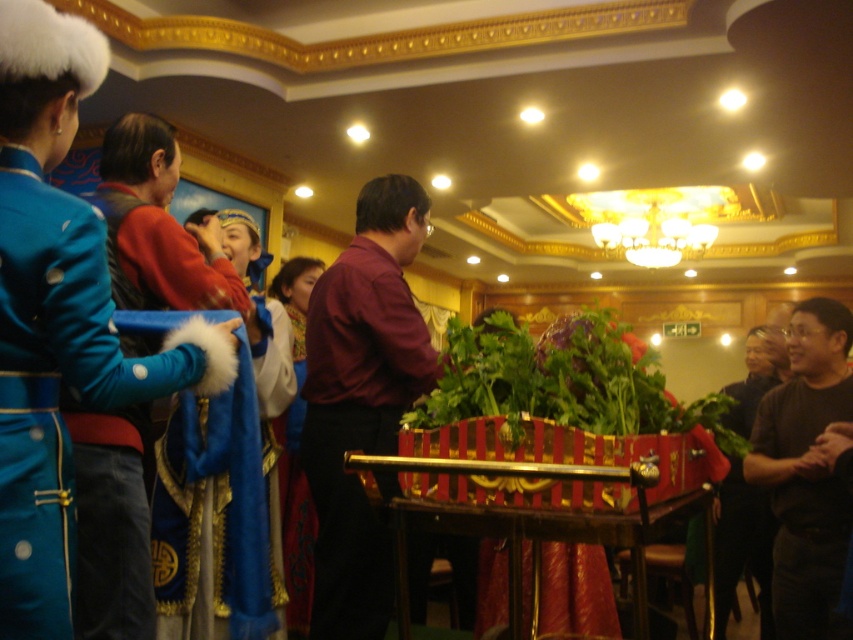
Question: Which object is farther from the camera taking this photo?

Choices:
 (A) velvet blue robe at left
 (B) dark brown leather jacket at lower right
 (C) black matte shirt at right

Answer: (B)

Question: Does black matte shirt at right have a lesser width compared to dark brown leather jacket at lower right?

Choices:
 (A) no
 (B) yes

Answer: (B)

Question: Which of the following is the farthest from the observer?

Choices:
 (A) dark brown leather jacket at lower right
 (B) maroon shirt at center
 (C) velvet blue robe at left
 (D) black matte shirt at right

Answer: (A)

Question: Is maroon shirt at center to the right of velvet blue robe at left from the viewer's perspective?

Choices:
 (A) yes
 (B) no

Answer: (A)

Question: Which object appears farthest from the camera in this image?

Choices:
 (A) dark brown leather jacket at lower right
 (B) black matte shirt at right
 (C) maroon shirt at center

Answer: (A)

Question: Is maroon shirt at center smaller than velvet blue robe at left?

Choices:
 (A) no
 (B) yes

Answer: (B)